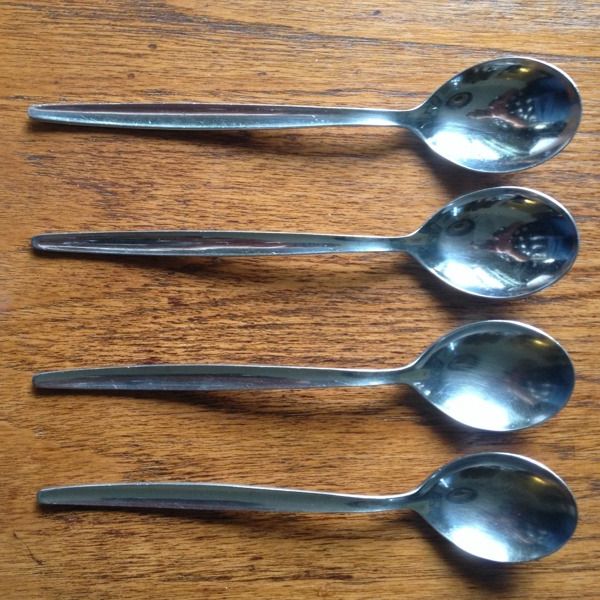
Find the location of a particular element. spoons is located at coordinates (513, 126), (492, 232), (497, 343), (491, 499).